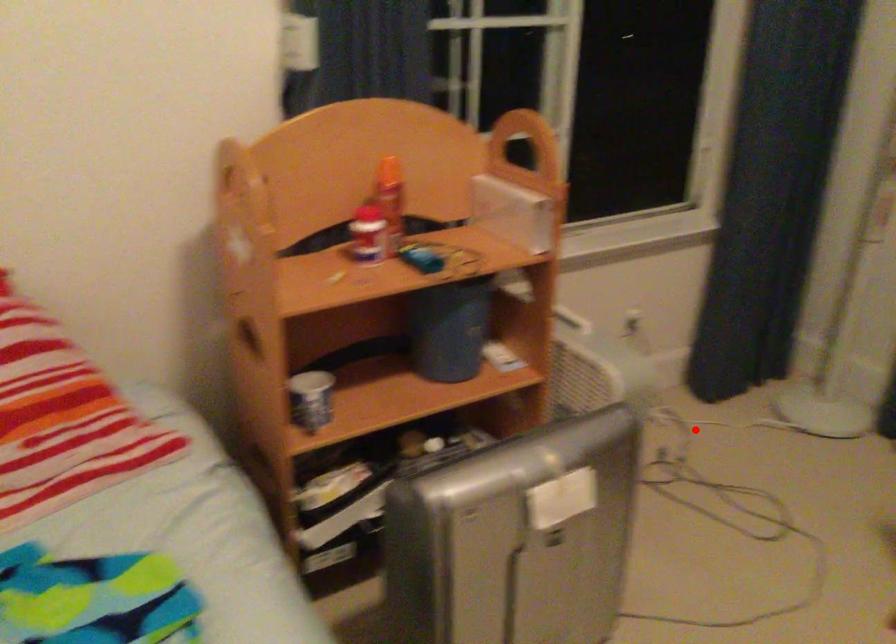
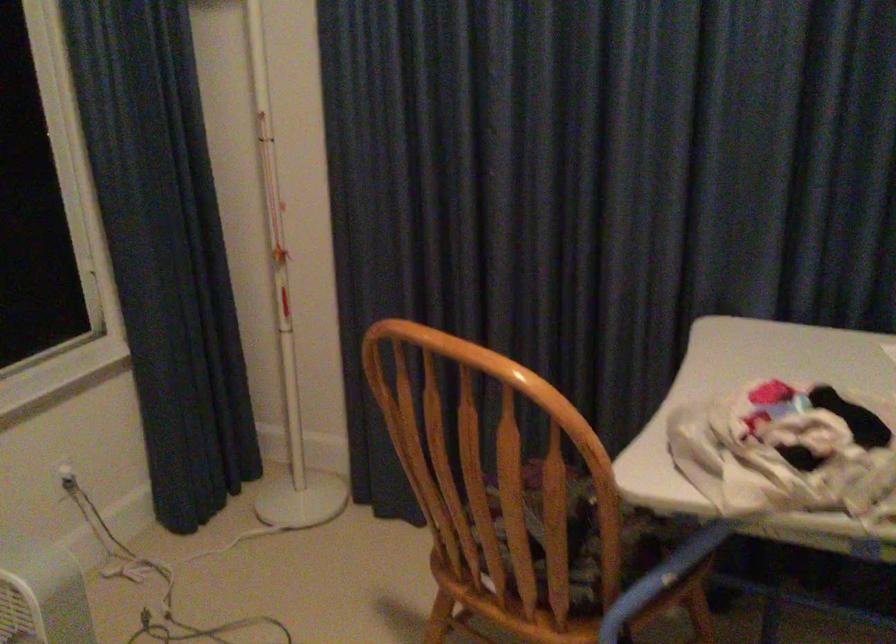
Where in the second image is the point corresponding to the highlighted location from the first image?

(164, 581)